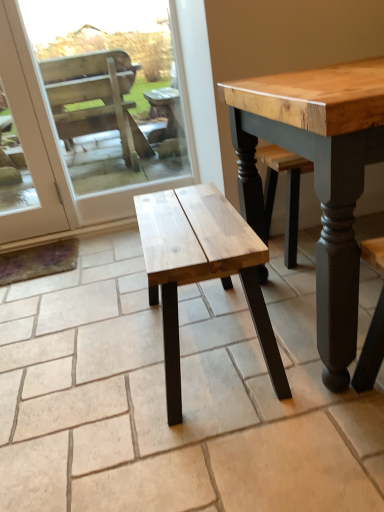
Question: Is natural wood bench at center inside or outside of wooden bench at lower center?

Choices:
 (A) outside
 (B) inside

Answer: (A)

Question: From a real-world perspective, is natural wood bench at center physically located above or below wooden bench at lower center?

Choices:
 (A) above
 (B) below

Answer: (B)

Question: Is natural wood bench at center taller or shorter than wooden bench at lower center?

Choices:
 (A) tall
 (B) short

Answer: (B)

Question: Considering the positions of wooden bench at lower center and natural wood bench at center in the image, is wooden bench at lower center bigger or smaller than natural wood bench at center?

Choices:
 (A) small
 (B) big

Answer: (A)

Question: In the image, is wooden bench at lower center on the left side or the right side of natural wood bench at center?

Choices:
 (A) right
 (B) left

Answer: (B)

Question: Considering the positions of wooden bench at lower center and natural wood bench at center in the image, is wooden bench at lower center wider or thinner than natural wood bench at center?

Choices:
 (A) wide
 (B) thin

Answer: (B)

Question: From a real-world perspective, is wooden bench at lower center physically located above or below natural wood bench at center?

Choices:
 (A) above
 (B) below

Answer: (A)